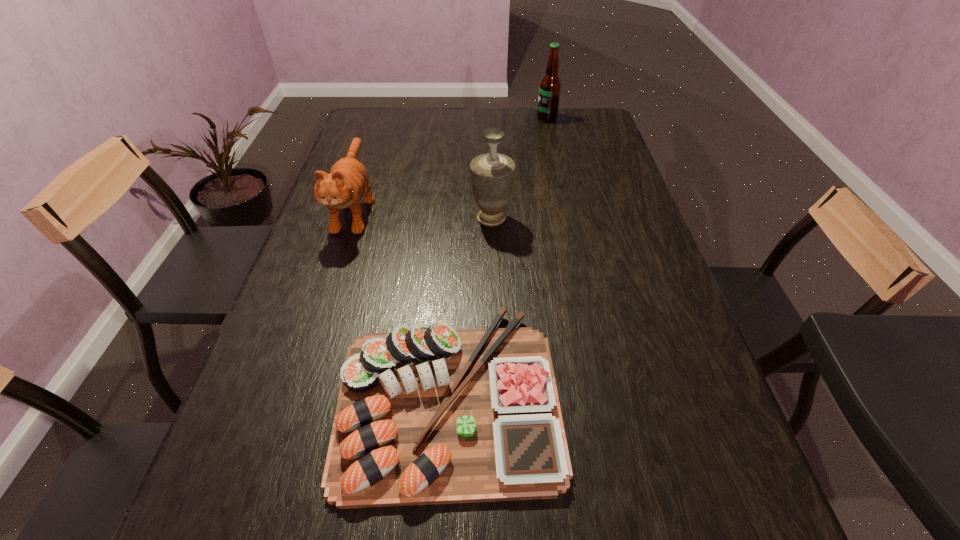
Find the location of a particular element. vacant space located on the right of the urn is located at coordinates pyautogui.click(x=563, y=218).

The image size is (960, 540). Find the location of `vacant space located on the face of the leftmost object`. vacant space located on the face of the leftmost object is located at coordinates (305, 361).

The width and height of the screenshot is (960, 540). Find the location of `vacant space located 0.100m on the right of the shortest object`. vacant space located 0.100m on the right of the shortest object is located at coordinates (612, 396).

Find the location of `object located in the far edge section of the desktop`. object located in the far edge section of the desktop is located at coordinates (550, 85).

This screenshot has width=960, height=540. In order to click on object at the left edge in this screenshot , I will do `click(348, 179)`.

Identify the location of vacant space at the far edge of the desktop. (412, 109).

Locate an element on the screen. The image size is (960, 540). free space at the left edge is located at coordinates (287, 327).

Where is `free space at the right edge of the desktop`? This screenshot has height=540, width=960. free space at the right edge of the desktop is located at coordinates (667, 383).

This screenshot has height=540, width=960. Find the location of `free space at the far left corner of the desktop`. free space at the far left corner of the desktop is located at coordinates (352, 139).

In the image, there is a desktop. Identify the location of free space at the far right corner. (572, 109).